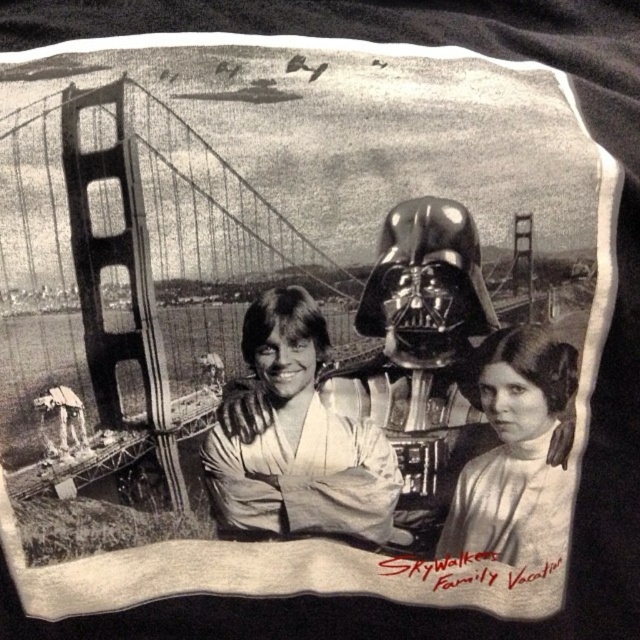
You are holding a ruler and want to measure the distance between the smooth white shirt at center and yourself. According to the image, how far apart are they?

The smooth white shirt at center and viewer are 30.80 inches apart from each other.

Consider the image. You are looking at the black and white graphic on a t shirt. You see a smooth white shirt at center and a smooth skin girl at lower right. Which object is positioned to the left?

The smooth white shirt at center is positioned to the left of the smooth skin girl at lower right.

You are designing a tshirt and want to place a new logo on the smooth white shirt at center. The logo requires a 1cm margin from the edge of the shirt. Given the shirt is at coordinates 0.684, 0.464 in the image, can you determine if there is enough space on the shirt to fit the logo?

The smooth white shirt at center is located at point (296, 436). Since the coordinates are normalized, the exact dimensions of the shirt aren t provided. Without knowing the shirt s size, it s impossible to determine if the 1cm margin requirement is met. Please provide the shirt s dimensions for an accurate assessment.